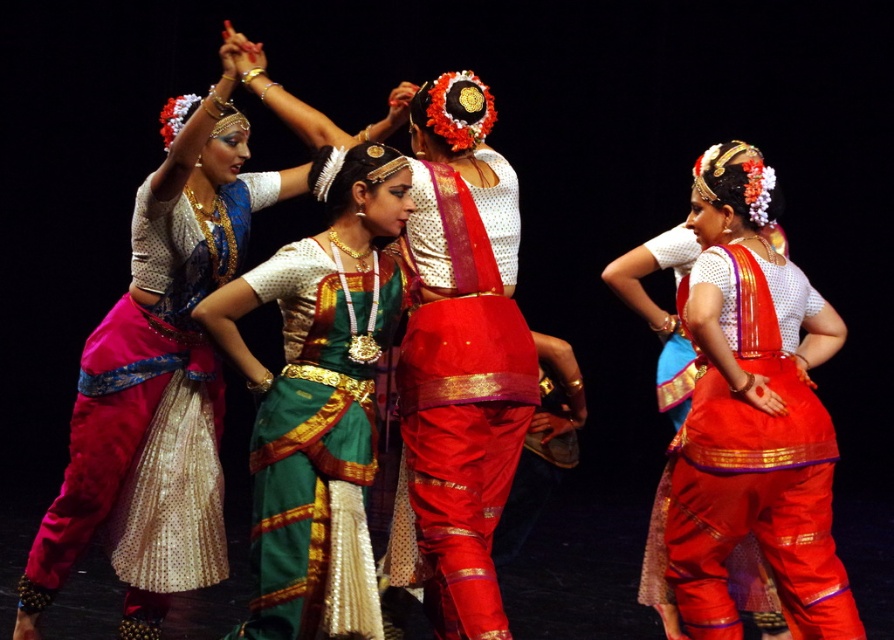
Who is higher up, shiny red saree at center or green silk saree at center?

shiny red saree at center

Identify the location of shiny red saree at center. (462, 388).

Does point (471, 353) come behind point (370, 280)?

No, it is not.

Locate an element on the screen. The height and width of the screenshot is (640, 894). shiny red saree at center is located at coordinates (462, 388).

Looking at this image, can you confirm if pink sequined skirt at left is positioned to the right of green silk saree at center?

Incorrect, pink sequined skirt at left is not on the right side of green silk saree at center.

Is pink sequined skirt at left thinner than green silk saree at center?

No, pink sequined skirt at left is not thinner than green silk saree at center.

The height and width of the screenshot is (640, 894). I want to click on pink sequined skirt at left, so click(154, 404).

Which is more to the right, pink sequined skirt at left or shiny red fabric saree at right?

From the viewer's perspective, shiny red fabric saree at right appears more on the right side.

Between point (128, 596) and point (720, 625), which one is positioned behind?

The point (128, 596) is behind.

This screenshot has height=640, width=894. In order to click on pink sequined skirt at left in this screenshot , I will do `click(154, 404)`.